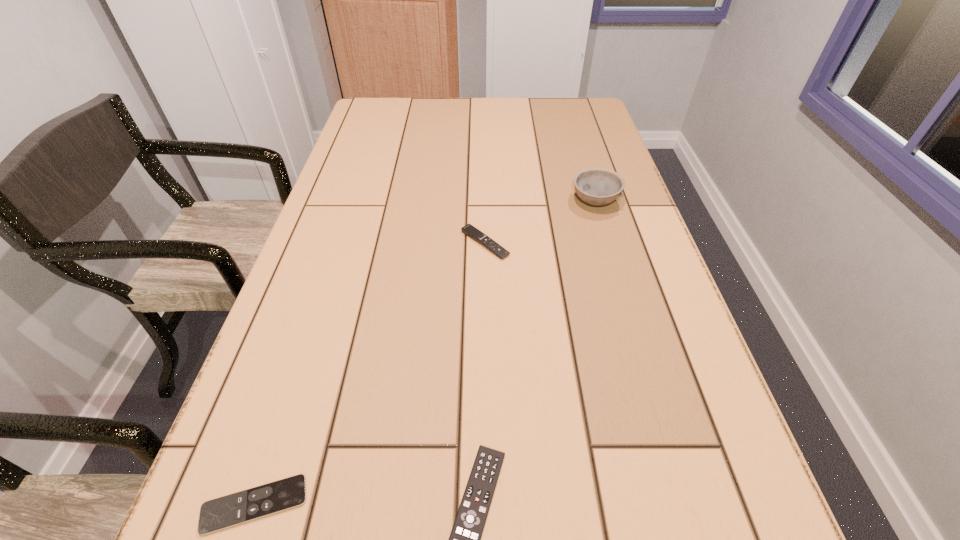
Identify which object is the third closest to the bowl. Please provide its 2D coordinates. Your answer should be formatted as a tuple, i.e. [(x, y)], where the tuple contains the x and y coordinates of a point satisfying the conditions above.

[(251, 504)]

Select which remote control appears as the second closest to the second shortest remote control. Please provide its 2D coordinates. Your answer should be formatted as a tuple, i.e. [(x, y)], where the tuple contains the x and y coordinates of a point satisfying the conditions above.

[(469, 230)]

Identify the location of remote control that is the third closest one to the tallest object. (251, 504).

At what (x,y) coordinates should I click in order to perform the action: click on free space in the image that satisfies the following two spatial constraints: 1. on the back side of the shortest object; 2. on the left side of the second farthest object. Please return your answer as a coordinate pair (x, y). Image resolution: width=960 pixels, height=540 pixels. Looking at the image, I should click on (341, 244).